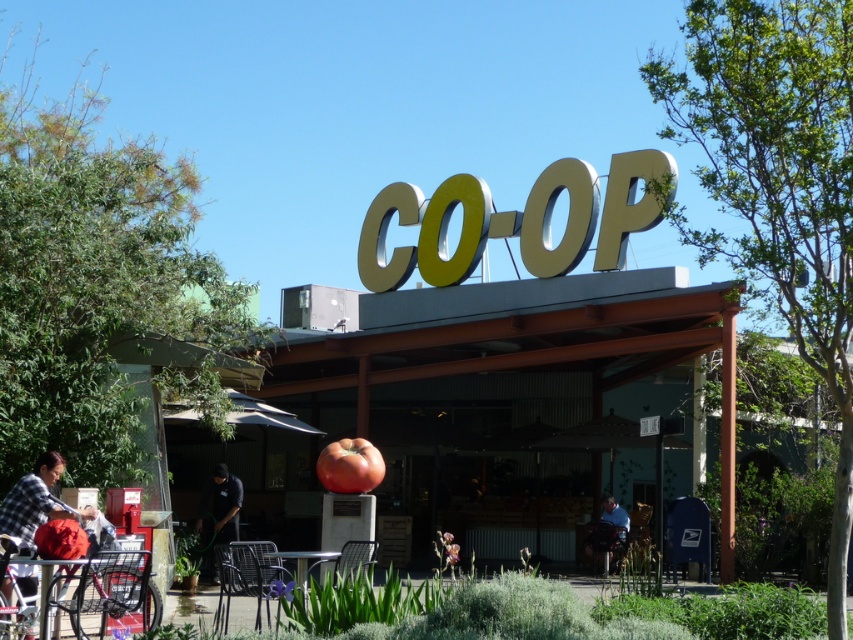
Between metallic gold sign at center and black smooth shirt at lower center, which one appears on the right side from the viewer's perspective?

Answer: Positioned to the right is metallic gold sign at center.

Who is taller, metallic gold sign at center or black smooth shirt at lower center?

Standing taller between the two is metallic gold sign at center.

Is point (550, 333) in front of point (219, 484)?

No, it is not.

In order to click on metallic gold sign at center in this screenshot , I will do `click(509, 355)`.

Does light blue shirt at center appear under metallic silver table at center?

Yes, light blue shirt at center is below metallic silver table at center.

Identify the location of light blue shirt at center. (608, 529).

Is metallic gold sign at center bigger than light blue shirt at center?

Yes, metallic gold sign at center is bigger than light blue shirt at center.

Is metallic gold sign at center taller than light blue shirt at center?

Yes, metallic gold sign at center is taller than light blue shirt at center.

Is point (422, 365) farther from camera compared to point (614, 529)?

Yes, point (422, 365) is behind point (614, 529).

I want to click on metallic gold sign at center, so [509, 355].